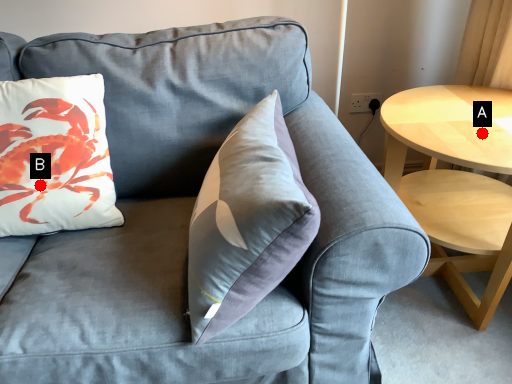
Question: Two points are circled on the image, labeled by A and B beside each circle. Which point is further to the camera?

Choices:
 (A) A is further
 (B) B is further

Answer: (A)